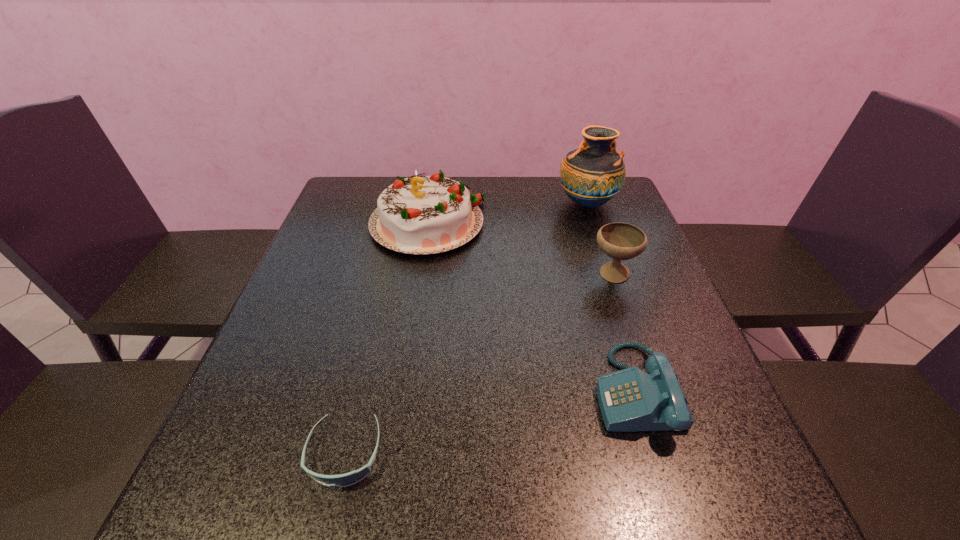
Where is `object positioned at the far left corner`? The height and width of the screenshot is (540, 960). object positioned at the far left corner is located at coordinates (420, 215).

Find the location of a particular element. This screenshot has width=960, height=540. object located in the near left corner section of the desktop is located at coordinates (347, 479).

The width and height of the screenshot is (960, 540). Find the location of `object at the far right corner`. object at the far right corner is located at coordinates (593, 174).

Image resolution: width=960 pixels, height=540 pixels. I want to click on blank space at the far edge of the desktop, so [x=522, y=190].

Locate an element on the screen. This screenshot has width=960, height=540. vacant point at the left edge is located at coordinates (293, 301).

This screenshot has width=960, height=540. I want to click on free space at the right edge, so click(x=657, y=435).

At what (x,y) coordinates should I click in order to perform the action: click on vacant position at the far left corner of the desktop. Please return your answer as a coordinate pair (x, y). Looking at the image, I should click on click(370, 185).

I want to click on free location at the far right corner, so click(x=613, y=213).

At what (x,y) coordinates should I click in order to perform the action: click on free area in between the chalice and the goggles. Please return your answer as a coordinate pair (x, y). This screenshot has width=960, height=540. Looking at the image, I should click on (479, 364).

Locate an element on the screen. This screenshot has height=540, width=960. free space between the goggles and the pottery is located at coordinates (466, 328).